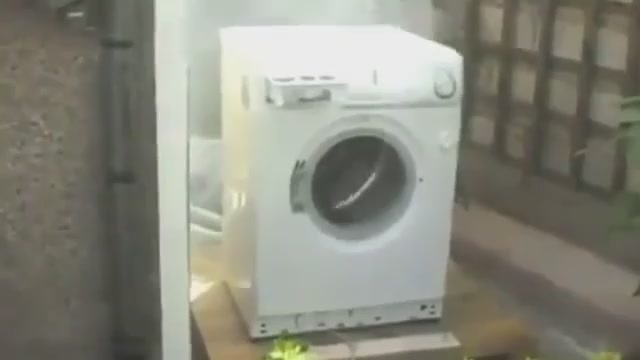
This screenshot has width=640, height=360. Identify the location of door. (162, 92).